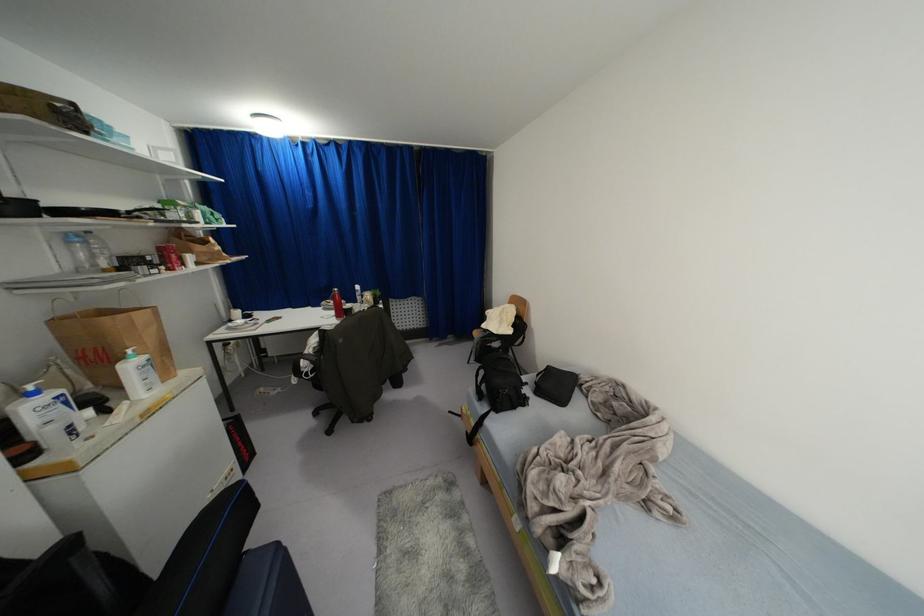
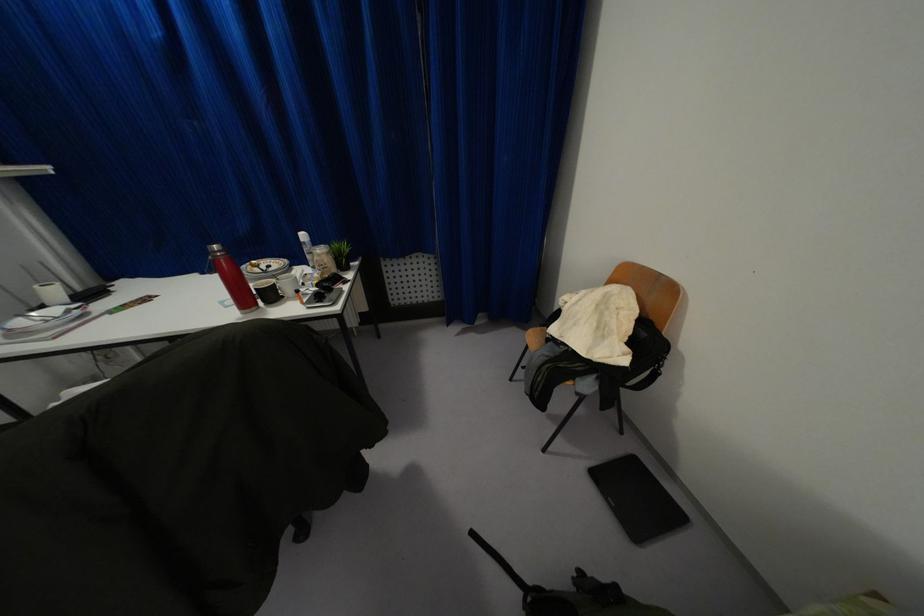
Locate, in the second image, the point that corresponds to (237,313) in the first image.

(53, 291)